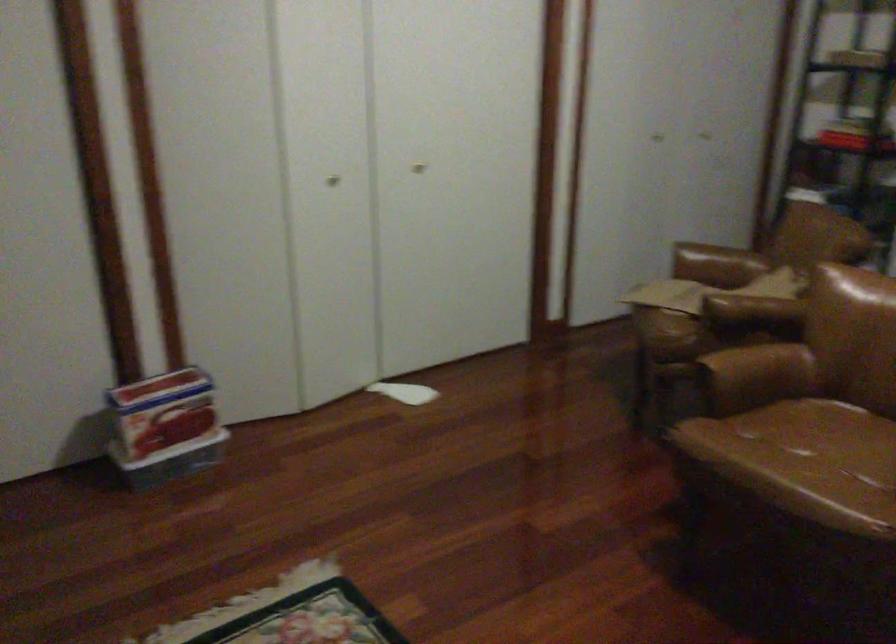
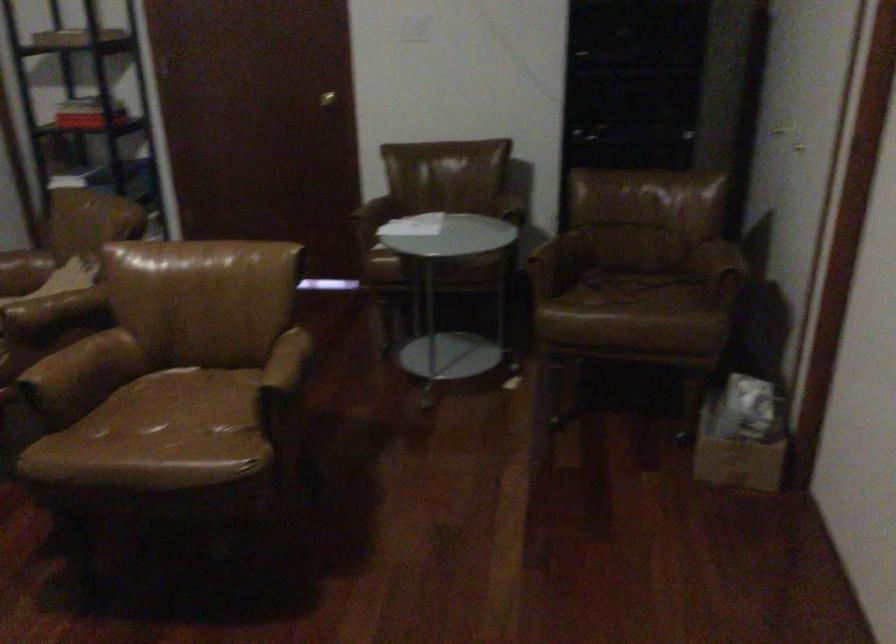
Question: The images are taken continuously from a first-person perspective. In which direction is your viewpoint rotating?

Choices:
 (A) Left
 (B) Right
 (C) Up
 (D) Down

Answer: (B)